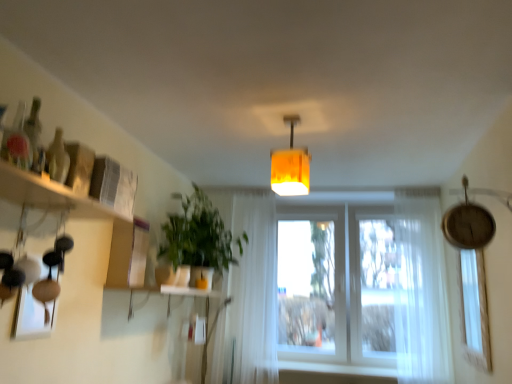
Image resolution: width=512 pixels, height=384 pixels. Find the location of `wooden shelf at left`. wooden shelf at left is located at coordinates (84, 218).

What do you see at coordinates (415, 301) in the screenshot?
I see `white sheer curtain at right, the 1th curtain when ordered from right to left` at bounding box center [415, 301].

What is the approximate width of orange fabric lampshade at center?

It is 6.96 inches.

How much space does white sheer curtain at center, which is counted as the 1th curtain, starting from the left, occupy horizontally?

6.34 inches.

Locate an element on the screen. white matte window sill at lower center is located at coordinates (333, 373).

From their relative heights in the image, would you say green matte plant at center-left is taller or shorter than white sheer curtain at center, which appears as the second curtain when viewed from the right?

green matte plant at center-left is shorter than white sheer curtain at center, which appears as the second curtain when viewed from the right.

Between point (195, 229) and point (271, 368), which one is positioned behind?

The point (271, 368) is farther from the camera.

From a real-world perspective, who is located lower, green matte plant at center-left or white sheer curtain at center, which appears as the second curtain when viewed from the right?

white sheer curtain at center, which appears as the second curtain when viewed from the right.

How far apart are green matte plant at center-left and white sheer curtain at center, which is counted as the 1th curtain, starting from the left?

green matte plant at center-left is 57.74 centimeters from white sheer curtain at center, which is counted as the 1th curtain, starting from the left.

Is green matte plant at center-left wider than orange fabric lampshade at center?

Indeed, green matte plant at center-left has a greater width compared to orange fabric lampshade at center.

Does point (159, 270) lie in front of point (296, 172)?

That is False.

The width and height of the screenshot is (512, 384). Find the location of `houseplant lying behind the orange fabric lampshade at center`. houseplant lying behind the orange fabric lampshade at center is located at coordinates (196, 238).

Looking at their sizes, would you say transparent glass window at right is wider or thinner than wooden shelf at left?

In the image, transparent glass window at right appears to be more narrow than wooden shelf at left.

Locate an element on the screen. The image size is (512, 384). window below the wooden shelf at left (from the image's perspective) is located at coordinates (474, 308).

Is transparent glass window at right positioned with its back to wooden shelf at left?

No.

Can you see transparent glass window at right touching wooden shelf at left?

Answer: They are not placed beside each other.

Based on the photo, from a real-world perspective, relative to white matte window sill at lower center, is translucent glass bottle at upper left vertically above or below?

translucent glass bottle at upper left is above white matte window sill at lower center.

Which is more to the right, translucent glass bottle at upper left or white matte window sill at lower center?

white matte window sill at lower center.

Does point (59, 141) come farther from viewer compared to point (382, 378)?

No, it is not.

Does translucent glass bottle at upper left contain white matte window sill at lower center?

Actually, white matte window sill at lower center is outside translucent glass bottle at upper left.

Could you tell me if wooden shelf at left is facing white sheer curtain at center, which appears as the second curtain when viewed from the right?

No, wooden shelf at left is not aimed at white sheer curtain at center, which appears as the second curtain when viewed from the right.

Does point (138, 274) lie in front of point (255, 217)?

That is True.

From the image's perspective, starting from the wooden shelf at left, which curtain is the 2nd one below? Please provide its 2D coordinates.

[(255, 291)]

From a real-world perspective, which is physically above, wooden shelf at left or white sheer curtain at center, which appears as the second curtain when viewed from the right?

From a 3D spatial view, wooden shelf at left is above.

In the scene shown: Is wooden shelf at left surrounding orange fabric lampshade at center?

That's incorrect, orange fabric lampshade at center is not inside wooden shelf at left.

From a real-world perspective, is wooden shelf at left positioned under orange fabric lampshade at center based on gravity?

Yes, from a real-world perspective, wooden shelf at left is below orange fabric lampshade at center.

Is the depth of wooden shelf at left greater than that of orange fabric lampshade at center?

No, it is in front of orange fabric lampshade at center.

Considering the points (69, 198) and (276, 150), which point is in front, point (69, 198) or point (276, 150)?

Point (69, 198)

Are white matte window sill at lower center and orange fabric lampshade at center far apart?

Yes, white matte window sill at lower center is far from orange fabric lampshade at center.

From the image's perspective, is white matte window sill at lower center under orange fabric lampshade at center?

Correct, white matte window sill at lower center appears lower than orange fabric lampshade at center in the image.

Is point (377, 379) closer to viewer compared to point (272, 183)?

No.

Which object is positioned more to the left, white matte window sill at lower center or orange fabric lampshade at center?

orange fabric lampshade at center.

This screenshot has height=384, width=512. What are the coordinates of `houseplant on the left of white sheer curtain at center, which appears as the second curtain when viewed from the right` in the screenshot? It's located at (196, 238).

I want to click on lamp located on the right of green matte plant at center-left, so click(290, 166).

From the image, which object appears to be farther from translucent glass bottle at upper left, wooden shelf at left or white sheer curtain at center, which appears as the second curtain when viewed from the right?

white sheer curtain at center, which appears as the second curtain when viewed from the right, is further to translucent glass bottle at upper left.

From the picture: From the image, which object appears to be nearer to transparent glass window at right, green matte plant at center-left or wooden shelf at left?

The object closer to transparent glass window at right is green matte plant at center-left.

Considering their positions, is transparent glass window at right positioned further to white matte window sill at lower center than wooden shelf at left?

wooden shelf at left is positioned further to the anchor white matte window sill at lower center.

Looking at the image, which one is located closer to orange fabric lampshade at center, white matte window sill at lower center or green matte plant at center-left?

green matte plant at center-left.

Which object lies further to the anchor point transparent glass window at right, white sheer curtain at center, which is counted as the 1th curtain, starting from the left, or wooden shelf at left?

The object further to transparent glass window at right is wooden shelf at left.

When comparing their distances from white sheer curtain at right, the second curtain from the left, does green matte plant at center-left or translucent glass bottle at upper left seem closer?

green matte plant at center-left is closer to white sheer curtain at right, the second curtain from the left.

From the picture: From the image, which object appears to be farther from green matte plant at center-left, white sheer curtain at right, the 1th curtain when ordered from right to left, or transparent glass window at right?

The object further to green matte plant at center-left is transparent glass window at right.

When comparing their distances from translucent glass bottle at upper left, does white matte window sill at lower center or orange fabric lampshade at center seem closer?

orange fabric lampshade at center is closer to translucent glass bottle at upper left.

You are a GUI agent. You are given a task and a screenshot of the screen. Output one action in this format:
    pyautogui.click(x=<x>, y=<y>)
    Task: Click on the lamp positioned between wooden shelf at left and white sheer curtain at center, which is counted as the 1th curtain, starting from the left, from near to far
    Image resolution: width=512 pixels, height=384 pixels.
    Given the screenshot: What is the action you would take?
    pyautogui.click(x=290, y=166)

Image resolution: width=512 pixels, height=384 pixels. In order to click on houseplant located between orange fabric lampshade at center and white sheer curtain at center, which is counted as the 1th curtain, starting from the left, in the depth direction in this screenshot , I will do `click(196, 238)`.

Find the location of a particular element. bottle between wooden shelf at left and white sheer curtain at right, the 1th curtain when ordered from right to left, in the horizontal direction is located at coordinates (58, 158).

Find the location of a particular element. window between translucent glass bottle at upper left and white sheer curtain at right, the second curtain from the left is located at coordinates (474, 308).